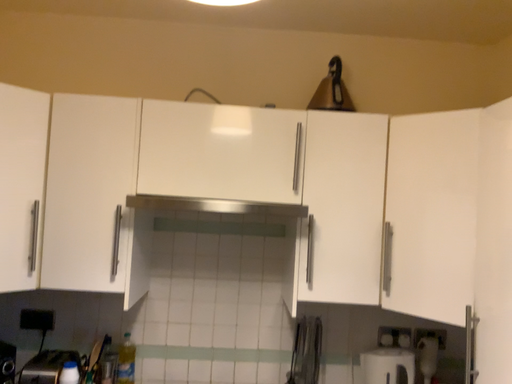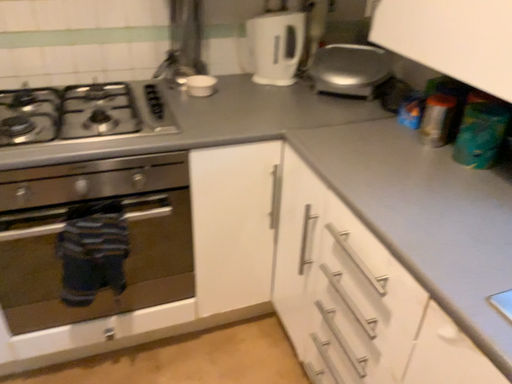
Question: How did the camera likely rotate when shooting the video?

Choices:
 (A) rotated left
 (B) rotated right

Answer: (B)